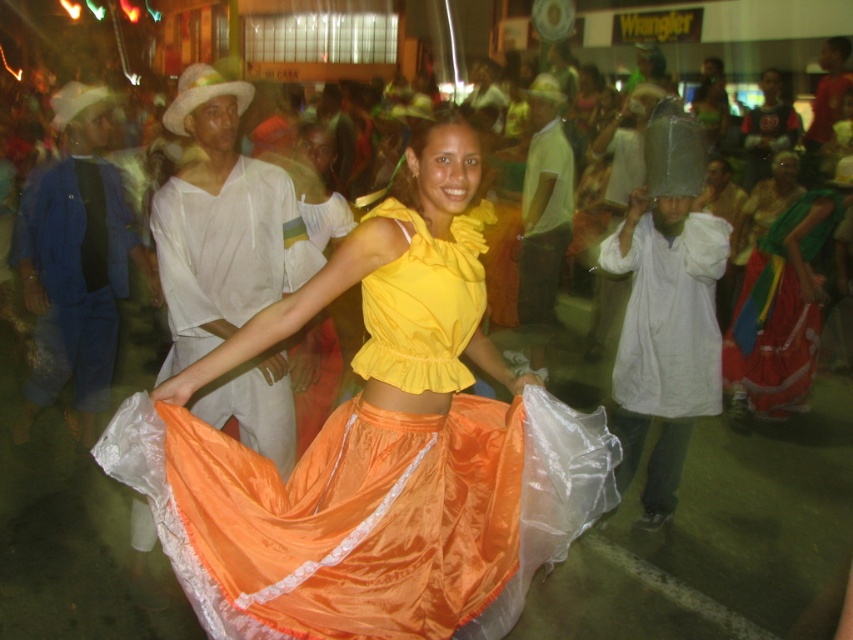
Based on the scene description, where is the shiny satin skirt at center located in terms of its 2D coordinates?

The shiny satin skirt at center is located at the 2D coordinates of point (375,451).

You are a photographer trying to capture the main dancer in the scene. You notice two skirts in the image, the shiny satin skirt at center and the silky orange skirt at lower right. Which skirt will appear more prominent in your photo due to its position?

The shiny satin skirt at center will appear more prominent in the photo because it is positioned in front of the silky orange skirt at lower right, making it closer to the camera.

You are a photographer standing at the center of the street scene. You notice two points marked in the image. The first point is at coordinate point (219,582) and the second is at coordinate point (781,237). Which point is closer to your position?

Point (219,582) is closer to the camera than point (781,237), so the first point is closer to your position.